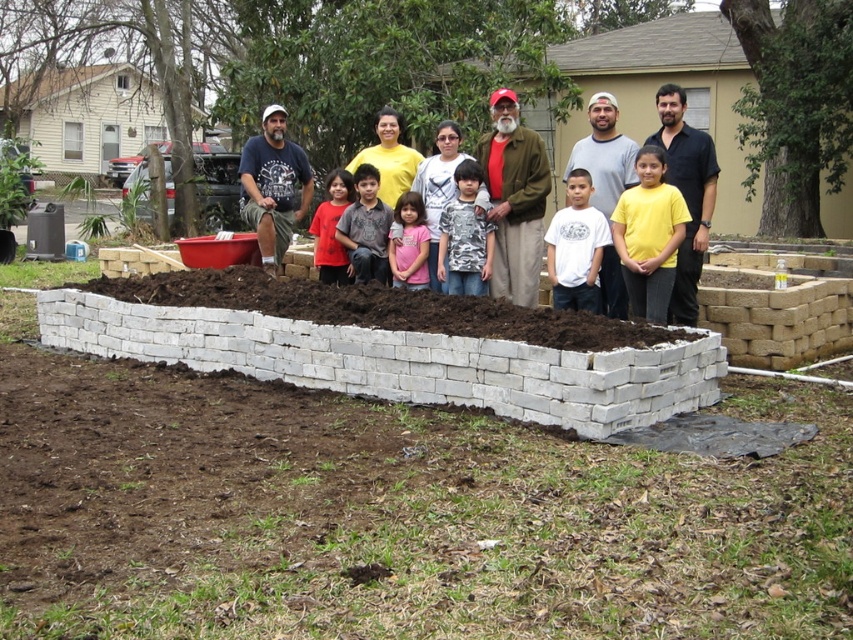
Does point (637, 248) come closer to viewer compared to point (378, 237)?

Yes, point (637, 248) is in front of point (378, 237).

Between point (677, 224) and point (338, 220), which one is positioned behind?

The point (338, 220) is behind.

Is point (660, 280) behind point (363, 193)?

No, (660, 280) is closer to viewer.

The image size is (853, 640). What are the coordinates of `yellow matte shirt at center` in the screenshot? It's located at (648, 236).

Who is more distant from viewer, (352, 252) or (334, 173)?

The point (334, 173) is more distant.

Can you confirm if dark brown shirt at center is positioned to the right of matte red shirt at center?

Yes, dark brown shirt at center is to the right of matte red shirt at center.

Between point (364, 173) and point (352, 179), which one is positioned behind?

Point (352, 179)

At what (x,y) coordinates should I click in order to perform the action: click on dark brown shirt at center. Please return your answer as a coordinate pair (x, y). The image size is (853, 640). Looking at the image, I should click on (366, 228).

Which is behind, point (373, 236) or point (392, 241)?

Positioned behind is point (373, 236).

Find the location of a particular element. The height and width of the screenshot is (640, 853). dark brown shirt at center is located at coordinates (366, 228).